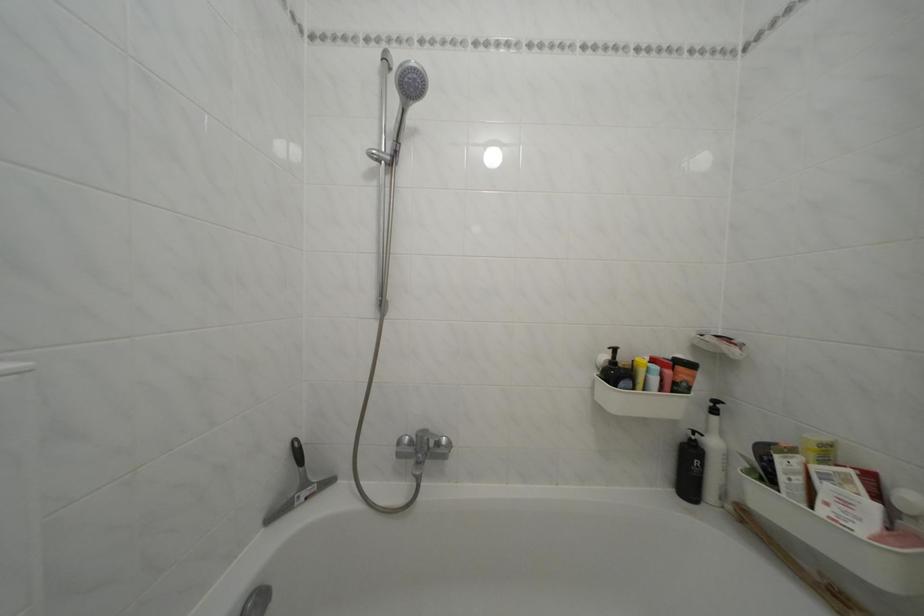
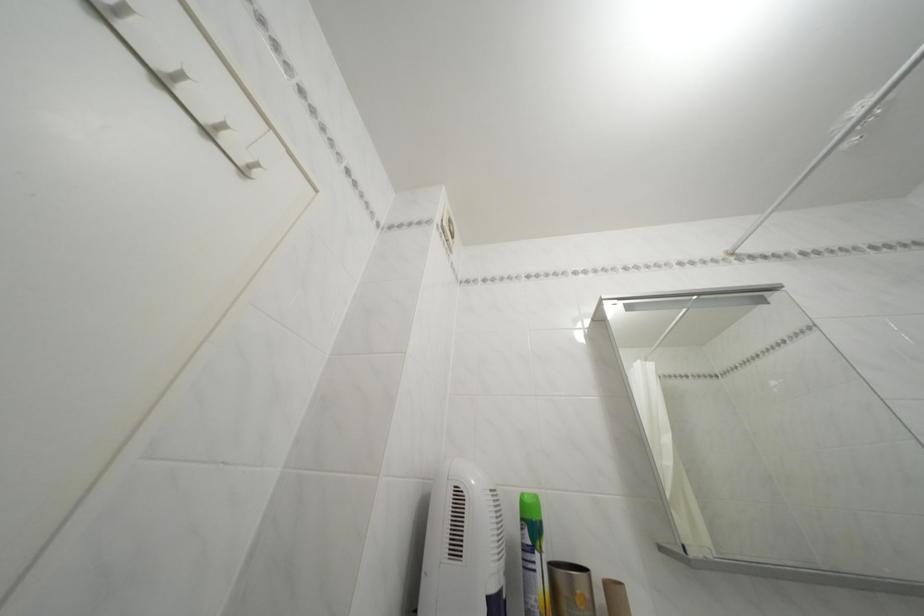
The first image is from the beginning of the video and the second image is from the end. How did the camera likely rotate when shooting the video?

The camera's rotation is toward left-up.